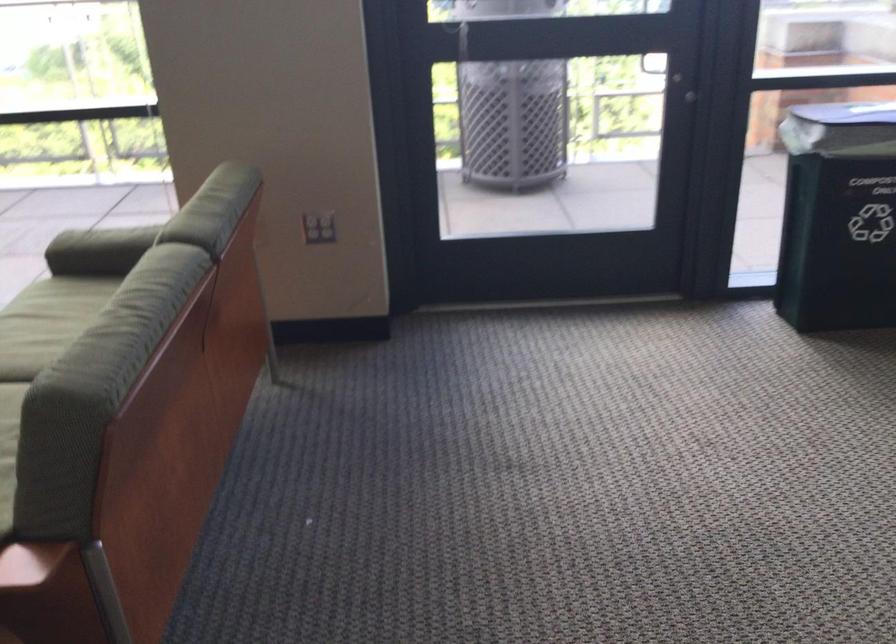
Where would you resting arm the green sofa armrest? Please return your answer as a coordinate pair (x, y).

(99, 247)